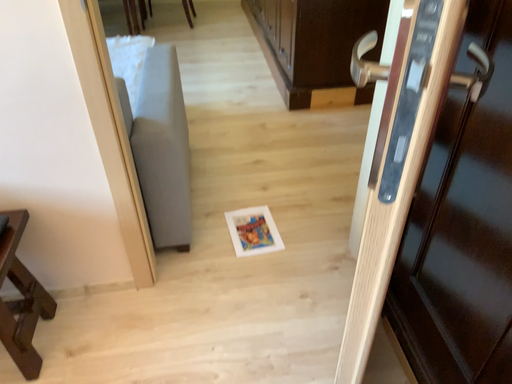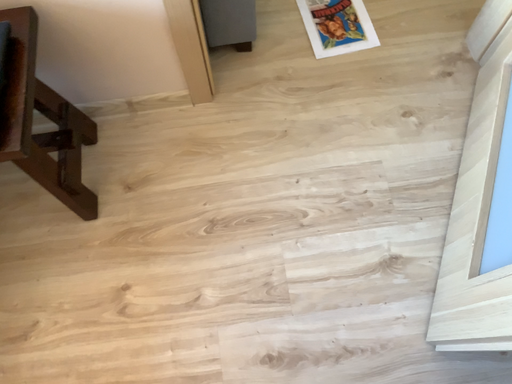
Question: Which way did the camera rotate in the video?

Choices:
 (A) rotated downward
 (B) rotated upward

Answer: (A)